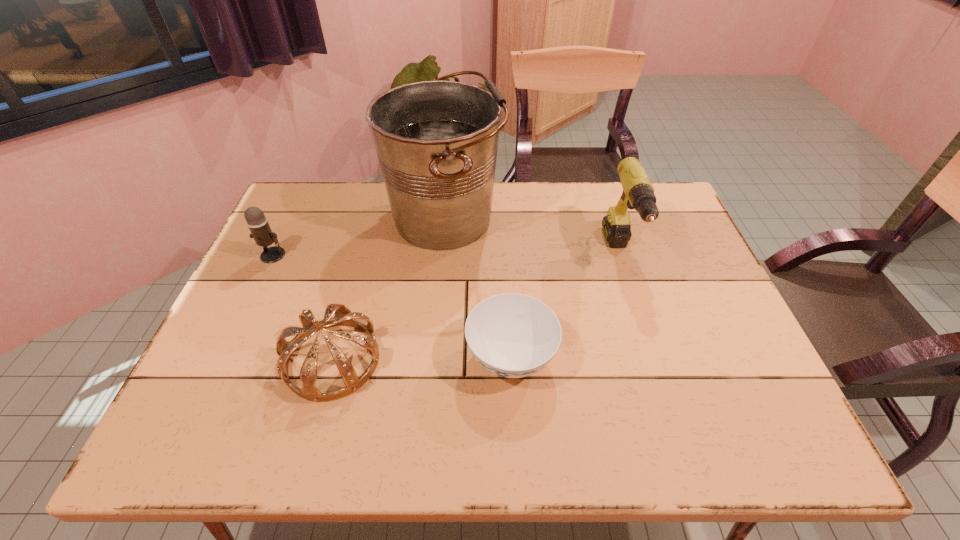
Where is `blank space located 0.270m on the left of the shortest object`? This screenshot has width=960, height=540. blank space located 0.270m on the left of the shortest object is located at coordinates pos(347,357).

You are a GUI agent. You are given a task and a screenshot of the screen. Output one action in this format:
    pyautogui.click(x=<x>, y=<y>)
    Task: Click on the bucket that is positioned at the far edge
    The image size is (960, 540).
    Given the screenshot: What is the action you would take?
    pyautogui.click(x=436, y=141)

Locate an element on the screen. drill located in the far edge section of the desktop is located at coordinates (638, 193).

You are a GUI agent. You are given a task and a screenshot of the screen. Output one action in this format:
    pyautogui.click(x=<x>, y=<y>)
    Task: Click on the object at the left edge
    The image size is (960, 540).
    Given the screenshot: What is the action you would take?
    pyautogui.click(x=257, y=223)

Find the location of `free spot at the far edge of the desktop`. free spot at the far edge of the desktop is located at coordinates pyautogui.click(x=506, y=193).

Identify the location of vacant region at the near edge of the desktop. (447, 415).

The height and width of the screenshot is (540, 960). In the image, there is a desktop. What are the coordinates of `vacant space at the left edge` in the screenshot? It's located at pyautogui.click(x=276, y=341).

The width and height of the screenshot is (960, 540). Identify the location of vacant space at the far left corner of the desktop. (326, 185).

I want to click on free area in between the shortest object and the second tallest object, so tap(565, 306).

At what (x,y) coordinates should I click in order to perform the action: click on empty space between the fourth shortest object and the bucket. Please return your answer as a coordinate pair (x, y). The width and height of the screenshot is (960, 540). Looking at the image, I should click on (533, 236).